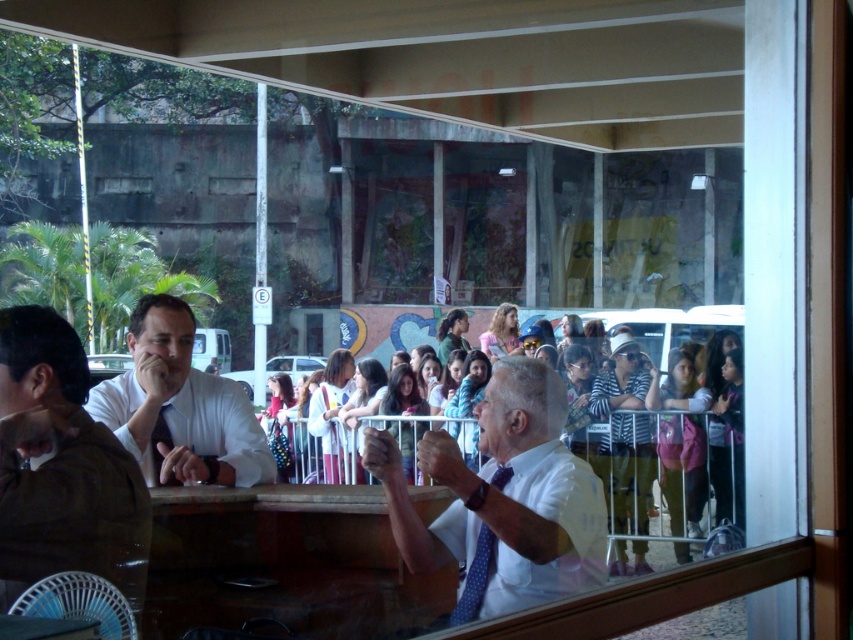
Which is below, white shirt at center or white matte shirt at left?

white shirt at center is lower down.

Between white shirt at center and white matte shirt at left, which one appears on the right side from the viewer's perspective?

Positioned to the right is white shirt at center.

Does point (689, 554) lie behind point (155, 404)?

Yes, point (689, 554) is behind point (155, 404).

Locate an element on the screen. This screenshot has height=640, width=853. white shirt at center is located at coordinates (660, 436).

Looking at this image, can you confirm if white shirt at center is positioned to the right of white polka dot tie at center?

Indeed, white shirt at center is positioned on the right side of white polka dot tie at center.

Which is above, white shirt at center or white polka dot tie at center?

Positioned higher is white polka dot tie at center.

Locate an element on the screen. white shirt at center is located at coordinates tap(660, 436).

Does point (138, 390) come closer to viewer compared to point (480, 544)?

No, it is not.

Looking at this image, which is above, white matte shirt at left or blue dotted tie at center?

white matte shirt at left

Which is behind, point (207, 408) or point (469, 566)?

Point (207, 408)

Where is `white matte shirt at left`? white matte shirt at left is located at coordinates click(x=178, y=406).